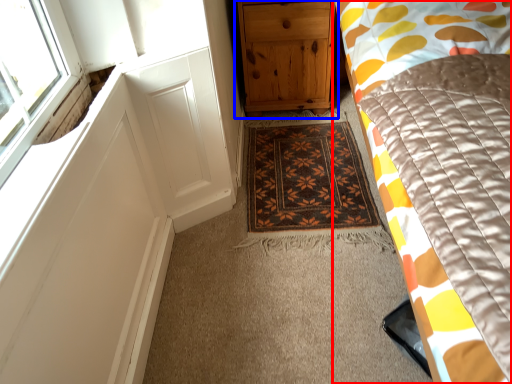
Question: Which object appears farthest to the camera in this image, bed (highlighted by a red box) or chest of drawers (highlighted by a blue box)?

Choices:
 (A) bed
 (B) chest of drawers

Answer: (B)